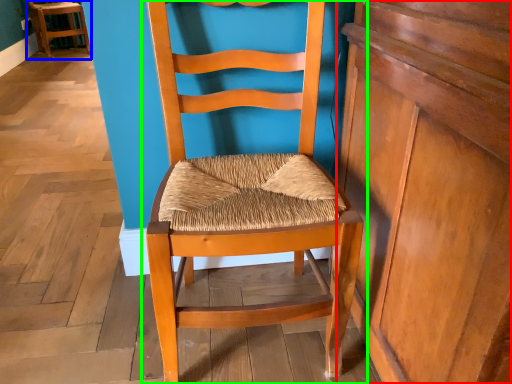
Question: Considering the real-world distances, which object is farthest from dresser (highlighted by a red box)? chair (highlighted by a blue box) or chair (highlighted by a green box)?

Choices:
 (A) chair
 (B) chair

Answer: (A)